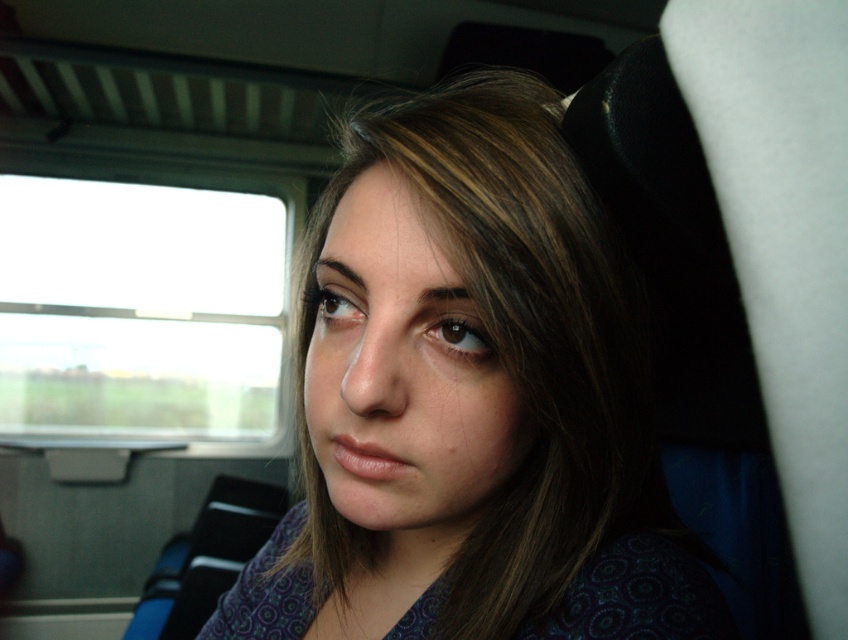
Is matte purple shirt at center to the right of transparent glass window at left from the viewer's perspective?

Indeed, matte purple shirt at center is positioned on the right side of transparent glass window at left.

Which is more to the left, matte purple shirt at center or transparent glass window at left?

transparent glass window at left is more to the left.

Describe the element at coordinates (470, 401) in the screenshot. I see `matte purple shirt at center` at that location.

This screenshot has width=848, height=640. In order to click on matte purple shirt at center in this screenshot , I will do `click(470, 401)`.